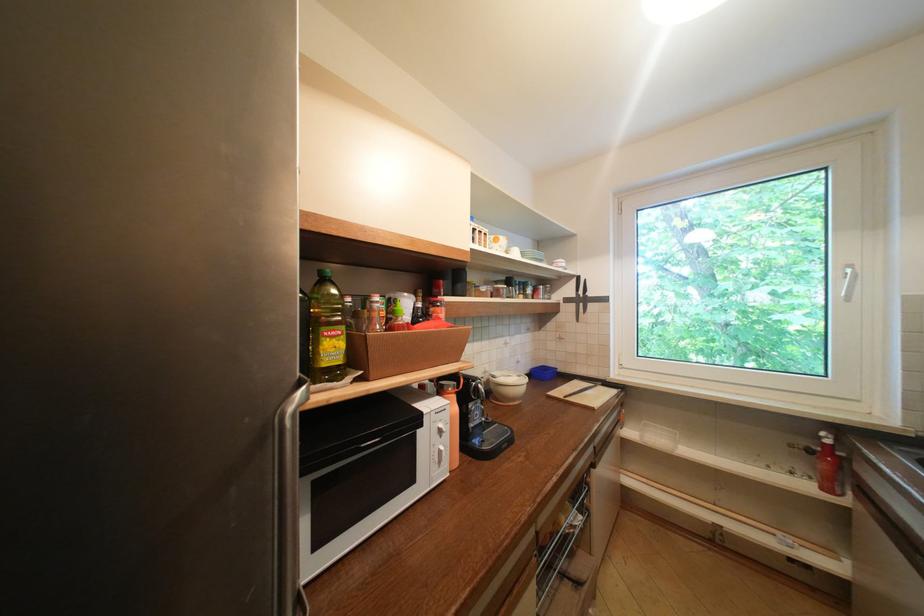
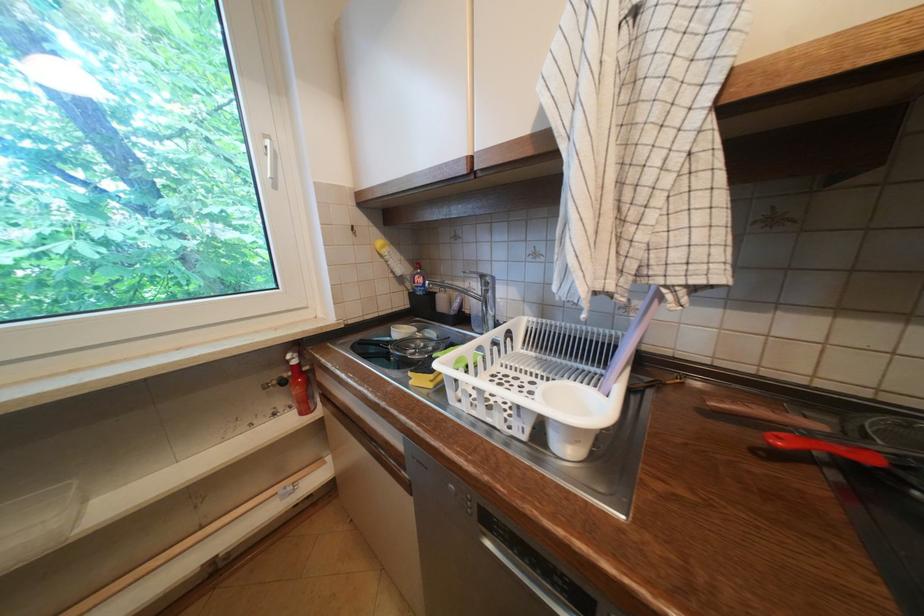
Question: The camera is either moving clockwise (left) or counter-clockwise (right) around the object. The first image is from the beginning of the video and the second image is from the end. Is the camera moving left or right when shooting the video?

Choices:
 (A) Left
 (B) Right

Answer: (A)